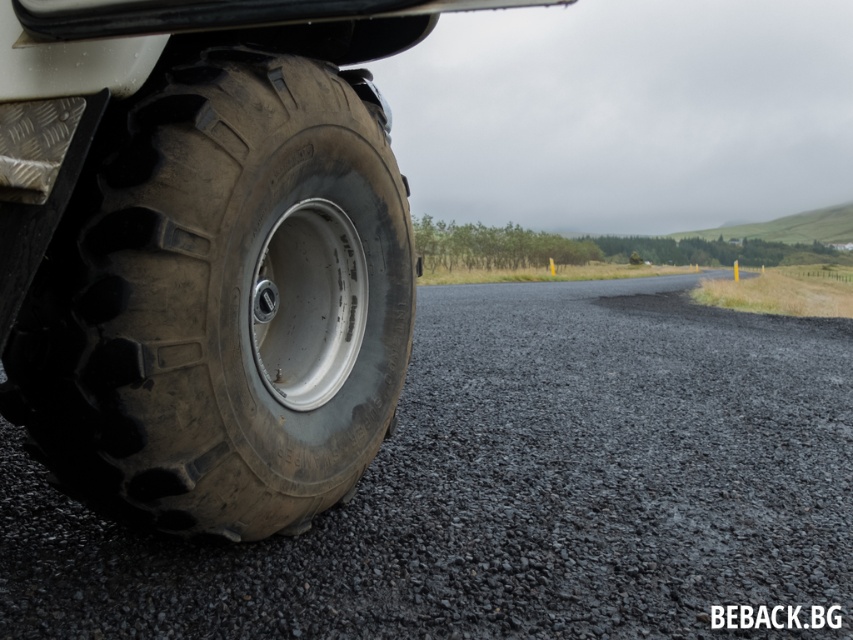
Does black gravel at lower left have a smaller size compared to black rubber tire at lower left?

Actually, black gravel at lower left might be larger than black rubber tire at lower left.

Does point (791, 397) come in front of point (296, 504)?

No.

At what (x,y) coordinates should I click in order to perform the action: click on black gravel at lower left. Please return your answer as a coordinate pair (x, y). Looking at the image, I should click on (511, 490).